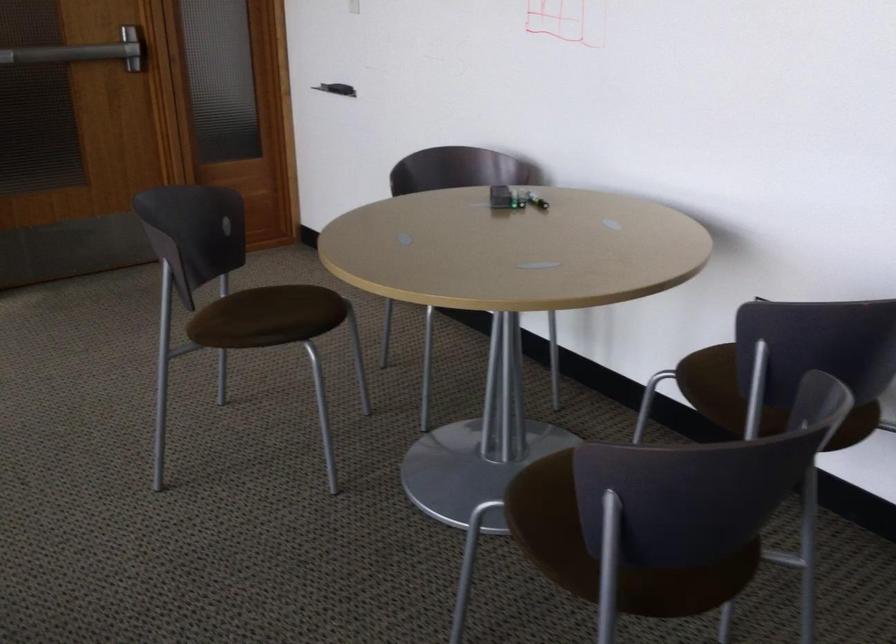
The location [498,198] corresponds to which object?

This point indicates the black whiteboard eraser.